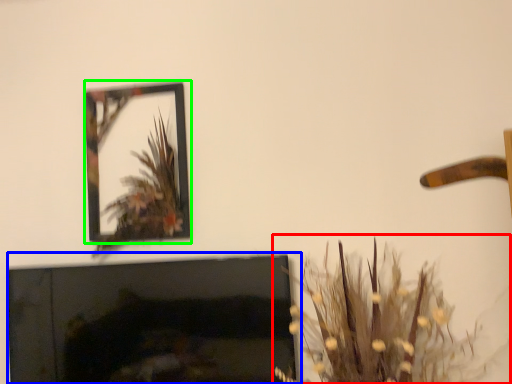
Question: Which object is positioned farthest from houseplant (highlighted by a red box)? Select from fireplace (highlighted by a blue box) and picture frame (highlighted by a green box).

Choices:
 (A) fireplace
 (B) picture frame

Answer: (B)